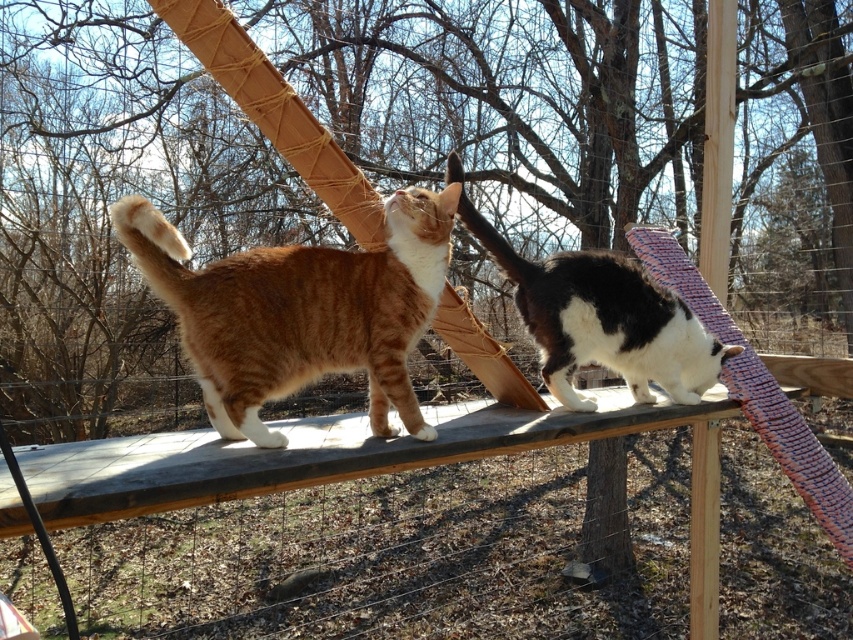
You are standing at the base of the wooden cat play structure and want to toss a toy to the orange tabby cat at center. If the toy has a throwing range of 6 feet, will it reach the cat?

The orange tabby cat at center is 6.38 feet away from the viewer. Since the throwing range is 6 feet, the toy will not reach the cat.

You are a cat owner trying to locate your two cats. You see an orange tabby cat at center and a black and white fur cat at center. Which cat is positioned to the left?

The orange tabby cat at center is positioned to the left of the black and white fur cat at center.

You are a cat owner observing the wooden cat play structure. You notice two cats on the structure. Which cat is closer to you, the orange tabby cat at center or the black and white fur cat at center?

The orange tabby cat at center is closer to you because it is in front of the black and white fur cat at center.